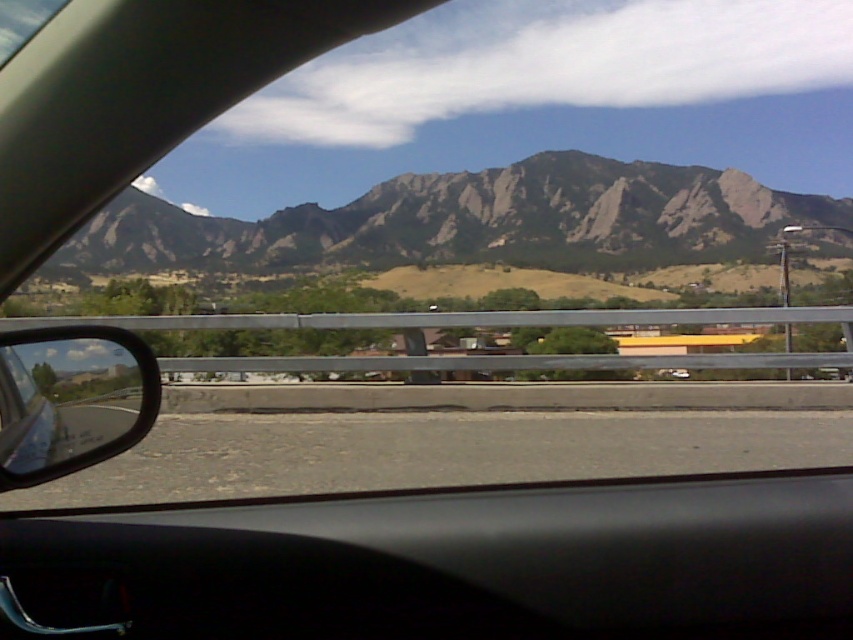
Question: Does black matte dashboard at center appear on the left side of shiny black mirror at left?

Choices:
 (A) yes
 (B) no

Answer: (B)

Question: Does black matte dashboard at center have a smaller size compared to shiny black mirror at left?

Choices:
 (A) yes
 (B) no

Answer: (A)

Question: Which point is closer to the camera taking this photo?

Choices:
 (A) (389, 602)
 (B) (0, 346)

Answer: (A)

Question: Is black matte dashboard at center bigger than shiny black mirror at left?

Choices:
 (A) yes
 (B) no

Answer: (B)